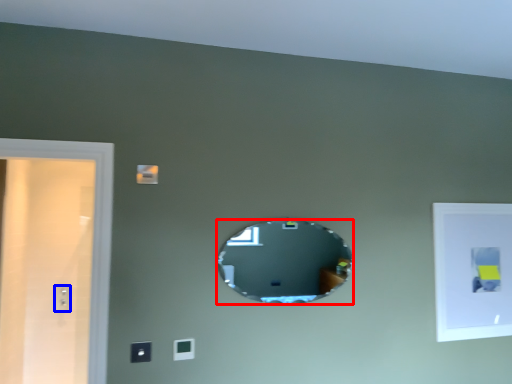
Question: Which of the following is the farthest to the observer, mirror (highlighted by a red box) or electric outlet (highlighted by a blue box)?

Choices:
 (A) mirror
 (B) electric outlet

Answer: (B)